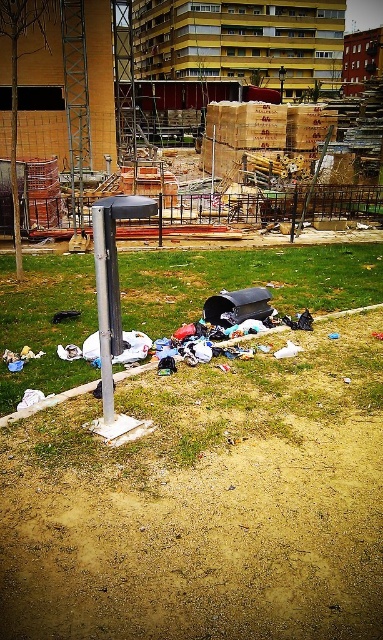
You are a drone operator tasked with capturing aerial footage of the construction site. You need to ensure that the camera focuses on the construction site in the background while avoiding the green grass at center. Given that the green grass at center is located at point (245,280), can you adjust the camera to avoid this area?

The green grass at center is located at point (245,280). To avoid capturing this area, adjust the camera angle or position so that the focus remains on the construction site in the background while excluding the coordinates of the green grass at center.

You are a city planner analyzing the urban scene. You need to determine which object occupies more horizontal space in the image between the green grass at center and the silver metallic pole at center. Which one is wider?

The green grass at center has a larger width than the silver metallic pole at center according to the description.